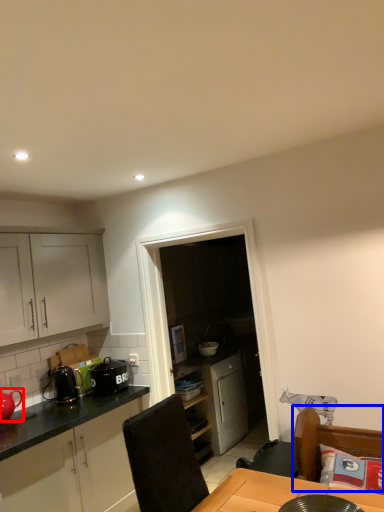
Question: Among these objects, which one is nearest to the camera, tea pot (highlighted by a red box) or swivel chair (highlighted by a blue box)?

Choices:
 (A) tea pot
 (B) swivel chair

Answer: (B)